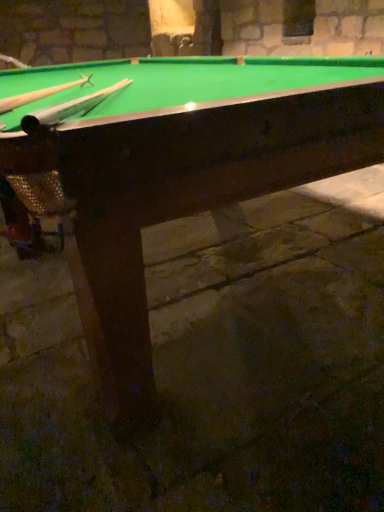
Where is `wooden cue at upper left, positioned as the 1th cue in right-to-left order`? wooden cue at upper left, positioned as the 1th cue in right-to-left order is located at coordinates (67, 110).

At what (x,y) coordinates should I click in order to perform the action: click on wooden cue at upper left, which is the 2th cue in right-to-left order. Please return your answer as a coordinate pair (x, y). The height and width of the screenshot is (512, 384). Looking at the image, I should click on (40, 94).

Where is `wooden cue at upper left, positioned as the 1th cue in right-to-left order`? wooden cue at upper left, positioned as the 1th cue in right-to-left order is located at coordinates (67, 110).

The image size is (384, 512). Identify the location of cue located underneath the wooden cue at upper left, which is the 2th cue in right-to-left order (from a real-world perspective). (67, 110).

Consider the image. From a real-world perspective, which object rests below the other?

wooden cue at upper left, which is the second cue in left-to-right order, from a real-world perspective.

Which is farther from the camera, [126,79] or [25,104]?

The point [126,79] is farther.

From the image's perspective, does wooden cue at upper left, positioned as the 1th cue in right-to-left order, appear lower than green felt billiard table at center?

Correct, wooden cue at upper left, positioned as the 1th cue in right-to-left order, appears lower than green felt billiard table at center in the image.

Could you tell me if wooden cue at upper left, which is the second cue in left-to-right order, is turned towards green felt billiard table at center?

Yes, wooden cue at upper left, which is the second cue in left-to-right order, is turned towards green felt billiard table at center.

In the image, is green felt billiard table at center on the left side or the right side of wooden cue at upper left, positioned as the 1th cue in right-to-left order?

Based on their positions, green felt billiard table at center is located to the left of wooden cue at upper left, positioned as the 1th cue in right-to-left order.

In the scene shown: Which of these two, green felt billiard table at center or wooden cue at upper left, positioned as the 1th cue in right-to-left order, stands taller?

green felt billiard table at center.

Is green felt billiard table at center aimed at wooden cue at upper left, positioned as the 1th cue in right-to-left order?

No, green felt billiard table at center is not facing towards wooden cue at upper left, positioned as the 1th cue in right-to-left order.

How many degrees apart are the facing directions of wooden cue at upper left, arranged as the 1th cue when viewed from the left, and green felt billiard table at center?

62.5 degrees.

From the image's perspective, is wooden cue at upper left, arranged as the 1th cue when viewed from the left, above green felt billiard table at center?

No.

From a real-world perspective, between wooden cue at upper left, which is the 2th cue in right-to-left order, and green felt billiard table at center, who is vertically lower?

green felt billiard table at center.

Would you say wooden cue at upper left, which is the 2th cue in right-to-left order, is inside or outside green felt billiard table at center?

wooden cue at upper left, which is the 2th cue in right-to-left order, is enclosed within green felt billiard table at center.

Does green felt billiard table at center have a lesser height compared to wooden cue at upper left, arranged as the 1th cue when viewed from the left?

In fact, green felt billiard table at center may be taller than wooden cue at upper left, arranged as the 1th cue when viewed from the left.

How different are the orientations of green felt billiard table at center and wooden cue at upper left, arranged as the 1th cue when viewed from the left, in degrees?

62.5 degrees separate the facing orientations of green felt billiard table at center and wooden cue at upper left, arranged as the 1th cue when viewed from the left.

Image resolution: width=384 pixels, height=512 pixels. I want to click on cue that is the 2nd object above the green felt billiard table at center (from a real-world perspective), so click(x=40, y=94).

Does green felt billiard table at center appear on the left side of wooden cue at upper left, arranged as the 1th cue when viewed from the left?

No, green felt billiard table at center is not to the left of wooden cue at upper left, arranged as the 1th cue when viewed from the left.

Considering the sizes of objects wooden cue at upper left, which is the 2th cue in right-to-left order, and wooden cue at upper left, which is the second cue in left-to-right order, in the image provided, who is thinner, wooden cue at upper left, which is the 2th cue in right-to-left order, or wooden cue at upper left, which is the second cue in left-to-right order,?

With smaller width is wooden cue at upper left, which is the 2th cue in right-to-left order.

Which of these two, wooden cue at upper left, arranged as the 1th cue when viewed from the left, or wooden cue at upper left, which is the second cue in left-to-right order, stands taller?

wooden cue at upper left, arranged as the 1th cue when viewed from the left.

Considering the positions of objects wooden cue at upper left, arranged as the 1th cue when viewed from the left, and wooden cue at upper left, which is the second cue in left-to-right order, in the image provided, who is in front, wooden cue at upper left, arranged as the 1th cue when viewed from the left, or wooden cue at upper left, which is the second cue in left-to-right order,?

wooden cue at upper left, which is the second cue in left-to-right order.

Is wooden cue at upper left, arranged as the 1th cue when viewed from the left, looking in the opposite direction of wooden cue at upper left, which is the second cue in left-to-right order?

No, wooden cue at upper left, arranged as the 1th cue when viewed from the left,'s orientation is not away from wooden cue at upper left, which is the second cue in left-to-right order.

Locate an element on the screen. This screenshot has height=512, width=384. cue lying above the wooden cue at upper left, positioned as the 1th cue in right-to-left order (from the image's perspective) is located at coordinates (40, 94).

Identify the location of the 1st cue behind the green felt billiard table at center, counting from the anchor's position. (67, 110).

Based on the photo, when comparing their distances from wooden cue at upper left, positioned as the 1th cue in right-to-left order, does green felt billiard table at center or wooden cue at upper left, which is the 2th cue in right-to-left order, seem further?

green felt billiard table at center lies further to wooden cue at upper left, positioned as the 1th cue in right-to-left order, than the other object.

Estimate the real-world distances between objects in this image. Which object is closer to wooden cue at upper left, arranged as the 1th cue when viewed from the left, green felt billiard table at center or wooden cue at upper left, which is the second cue in left-to-right order?

The object closer to wooden cue at upper left, arranged as the 1th cue when viewed from the left, is wooden cue at upper left, which is the second cue in left-to-right order.

From the image, which object appears to be nearer to green felt billiard table at center, wooden cue at upper left, which is the 2th cue in right-to-left order, or wooden cue at upper left, positioned as the 1th cue in right-to-left order?

wooden cue at upper left, positioned as the 1th cue in right-to-left order, lies closer to green felt billiard table at center than the other object.

Looking at the image, which one is located closer to green felt billiard table at center, wooden cue at upper left, positioned as the 1th cue in right-to-left order, or wooden cue at upper left, arranged as the 1th cue when viewed from the left?

wooden cue at upper left, positioned as the 1th cue in right-to-left order, is closer to green felt billiard table at center.

Looking at the image, which one is located closer to wooden cue at upper left, which is the second cue in left-to-right order, wooden cue at upper left, which is the 2th cue in right-to-left order, or green felt billiard table at center?

wooden cue at upper left, which is the 2th cue in right-to-left order.

Looking at the image, which one is located closer to wooden cue at upper left, which is the 2th cue in right-to-left order, wooden cue at upper left, which is the second cue in left-to-right order, or green felt billiard table at center?

Based on the image, wooden cue at upper left, which is the second cue in left-to-right order, appears to be nearer to wooden cue at upper left, which is the 2th cue in right-to-left order.

The height and width of the screenshot is (512, 384). I want to click on cue between green felt billiard table at center and wooden cue at upper left, which is the 2th cue in right-to-left order, in the front-back direction, so click(x=67, y=110).